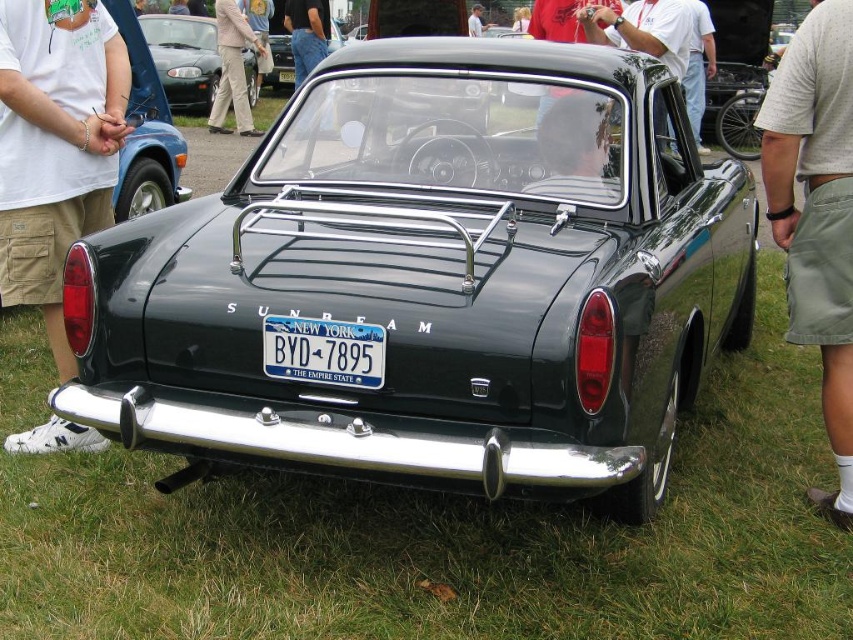
You are standing at the rear of the Sunbeam car at a car show. You want to take a photo of the license plate BYD7895 without getting too close. If you are currently at point (827,138), which is 3.30 meters away from the license plate, can you capture the license plate clearly in your photo?

Since the distance between point (827,138) and the license plate is 3.30 meters, you can capture the license plate clearly as long as your camera has sufficient zoom or you move closer.

You are standing at the rear of the Sunbeam car and want to touch both the blue metallic license plate at center and the white fabric shirt at center. Which object is farther from your current position?

The blue metallic license plate at center is 51.90 feet away from the white fabric shirt at center, so the object farther away depends on your position. Since you are at the rear of the car, the white fabric shirt at center is likely closer to you, making the blue metallic license plate at center the farther one.